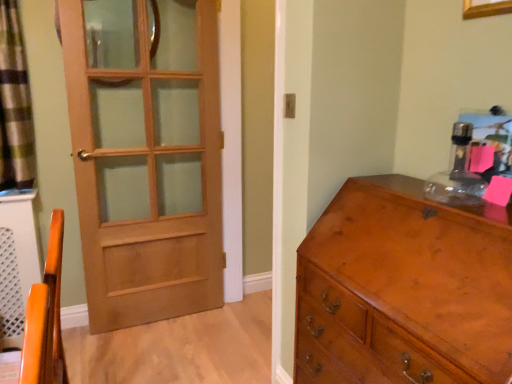
Question: From a real-world perspective, relative to light brown wood door at left, is green plaid curtain at left vertically above or below?

Choices:
 (A) above
 (B) below

Answer: (A)

Question: From the image's perspective, relative to light brown wood door at left, is green plaid curtain at left above or below?

Choices:
 (A) above
 (B) below

Answer: (A)

Question: Estimate the real-world distances between objects in this image. Which object is closer to the shiny brown wooden chest of drawers at right?

Choices:
 (A) light brown wood door at left
 (B) green plaid curtain at left

Answer: (A)

Question: Estimate the real-world distances between objects in this image. Which object is closer to the light brown wood door at left?

Choices:
 (A) green plaid curtain at left
 (B) shiny brown wooden chest of drawers at right

Answer: (A)